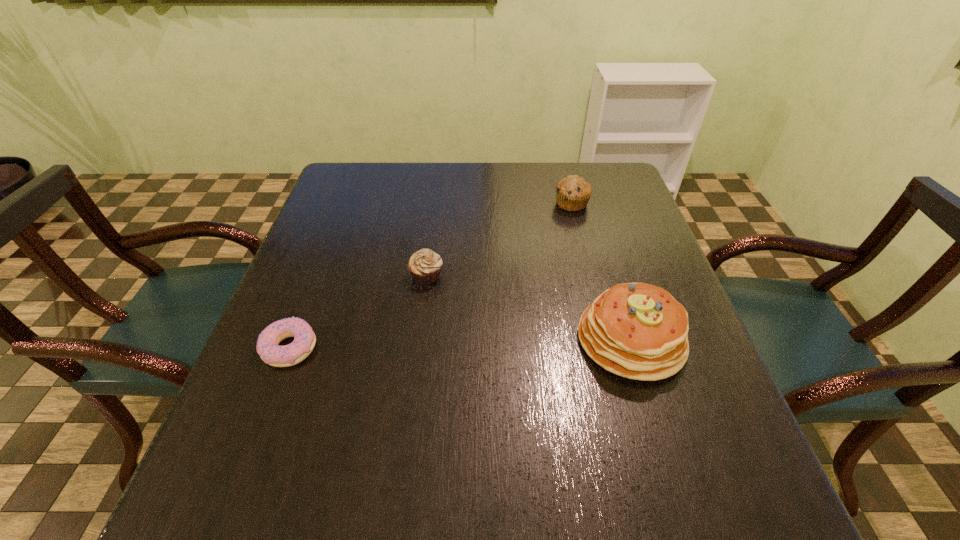
Where is `the tallest object`? This screenshot has width=960, height=540. the tallest object is located at coordinates click(x=639, y=331).

Where is `the taller muffin`? This screenshot has height=540, width=960. the taller muffin is located at coordinates (573, 192).

Where is `the third shortest object`? This screenshot has height=540, width=960. the third shortest object is located at coordinates (573, 192).

The height and width of the screenshot is (540, 960). Identify the location of the nearer muffin. (425, 265).

Image resolution: width=960 pixels, height=540 pixels. What are the coordinates of `the third tallest object` in the screenshot? It's located at (425, 265).

Locate an element on the screen. This screenshot has width=960, height=540. the leftmost object is located at coordinates (268, 347).

The height and width of the screenshot is (540, 960). What are the coordinates of `doughnut` in the screenshot? It's located at click(x=268, y=347).

Find the location of a particular element. The width and height of the screenshot is (960, 540). vacant space situated on the back of the pancake is located at coordinates (606, 259).

You are a GUI agent. You are given a task and a screenshot of the screen. Output one action in this format:
    pyautogui.click(x=<x>, y=<y>)
    Task: Click on the vacant space located 0.250m on the front of the farthest object
    The width and height of the screenshot is (960, 540).
    Given the screenshot: What is the action you would take?
    pyautogui.click(x=590, y=278)

This screenshot has width=960, height=540. I want to click on vacant position located 0.320m on the right of the nearer muffin, so click(581, 275).